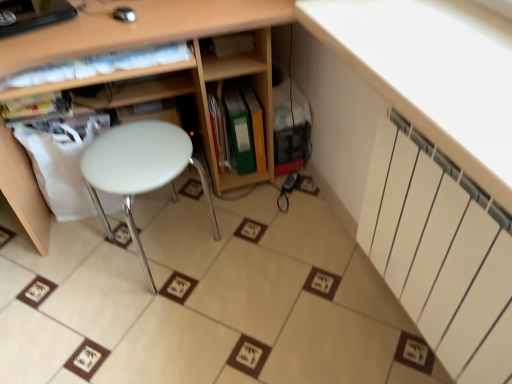
This screenshot has width=512, height=384. I want to click on free point in front of white plastic stool at center, so click(155, 331).